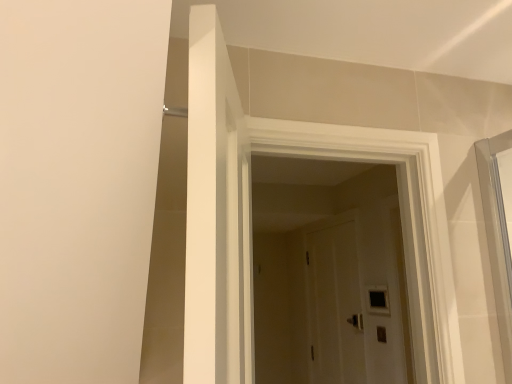
Question: Considering the relative sizes of white wooden door at center and black glass window at center in the image provided, is white wooden door at center bigger than black glass window at center?

Choices:
 (A) yes
 (B) no

Answer: (A)

Question: Considering the relative sizes of white wooden door at center and black glass window at center in the image provided, is white wooden door at center wider than black glass window at center?

Choices:
 (A) yes
 (B) no

Answer: (A)

Question: Can you confirm if white wooden door at center is shorter than black glass window at center?

Choices:
 (A) no
 (B) yes

Answer: (A)

Question: From a real-world perspective, is white wooden door at center positioned over black glass window at center based on gravity?

Choices:
 (A) yes
 (B) no

Answer: (A)

Question: Is black glass window at center surrounded by white wooden door at center?

Choices:
 (A) no
 (B) yes

Answer: (A)

Question: Is white wooden door at center closer to camera compared to black glass window at center?

Choices:
 (A) no
 (B) yes

Answer: (B)

Question: Does black glass window at center have a lesser width compared to white wooden door at center?

Choices:
 (A) no
 (B) yes

Answer: (B)

Question: Does black glass window at center appear on the left side of white wooden door at center?

Choices:
 (A) yes
 (B) no

Answer: (B)

Question: From a real-world perspective, is black glass window at center physically above white wooden door at center?

Choices:
 (A) no
 (B) yes

Answer: (A)

Question: From the image's perspective, is black glass window at center beneath white wooden door at center?

Choices:
 (A) yes
 (B) no

Answer: (A)

Question: Considering the relative sizes of black glass window at center and white wooden door at center in the image provided, is black glass window at center wider than white wooden door at center?

Choices:
 (A) yes
 (B) no

Answer: (B)

Question: From the image's perspective, is black glass window at center on white wooden door at center?

Choices:
 (A) yes
 (B) no

Answer: (B)

Question: Do you think black glass window at center is within white wooden door at center, or outside of it?

Choices:
 (A) outside
 (B) inside

Answer: (A)